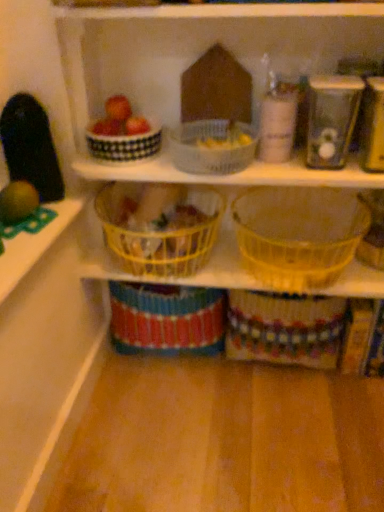
Describe the element at coordinates (125, 145) in the screenshot. I see `white checkered basket at upper center, the 4th basket when ordered from right to left` at that location.

Identify the location of translucent plastic basket at center, placed as the third basket when sorted from left to right. This screenshot has height=512, width=384. (213, 147).

What is the approximate width of matte red apple at upper left?

2.27 inches.

This screenshot has width=384, height=512. What are the coordinates of `metallic silver toaster at upper right, which ranks as the 2th appliance in left-to-right order` in the screenshot? It's located at (373, 126).

Image resolution: width=384 pixels, height=512 pixels. In order to click on metallic silver canister at upper right, which is counted as the 2th appliance, starting from the right in this screenshot , I will do `click(331, 119)`.

Locate an element on the screen. Image resolution: width=384 pixels, height=512 pixels. yellow plastic basket at center, the third basket viewed from the right is located at coordinates (160, 231).

Is metallic silver canister at upper right, which is counted as the 2th appliance, starting from the right, oriented towards translucent plastic basket at center, which is the second basket from right to left?

No, metallic silver canister at upper right, which is counted as the 2th appliance, starting from the right, is not turned towards translucent plastic basket at center, which is the second basket from right to left.

In the scene shown: In terms of height, does metallic silver canister at upper right, which is the first appliance in left-to-right order, look taller or shorter compared to translucent plastic basket at center, which is the second basket from right to left?

Considering their sizes, metallic silver canister at upper right, which is the first appliance in left-to-right order, has more height than translucent plastic basket at center, which is the second basket from right to left.

Based on the photo, in terms of width, does metallic silver canister at upper right, which is counted as the 2th appliance, starting from the right, look wider or thinner when compared to translucent plastic basket at center, placed as the third basket when sorted from left to right?

Clearly, metallic silver canister at upper right, which is counted as the 2th appliance, starting from the right, has less width compared to translucent plastic basket at center, placed as the third basket when sorted from left to right.

In the scene shown: Between matte red apple at upper left and metallic silver canister at upper right, which is the first appliance in left-to-right order, which one has larger width?

With larger width is metallic silver canister at upper right, which is the first appliance in left-to-right order.

Is metallic silver canister at upper right, which is the first appliance in left-to-right order, completely or partially inside matte red apple at upper left?

Definitely not — metallic silver canister at upper right, which is the first appliance in left-to-right order, is not inside matte red apple at upper left.

Does matte red apple at upper left have a smaller size compared to metallic silver canister at upper right, which is the first appliance in left-to-right order?

Yes, matte red apple at upper left is smaller than metallic silver canister at upper right, which is the first appliance in left-to-right order.

Based on the photo, does matte red apple at upper left turn towards metallic silver canister at upper right, which is the first appliance in left-to-right order?

No.

How many degrees apart are the facing directions of white checkered basket at upper center, which ranks as the first basket in left-to-right order, and translucent plastic basket at center, positioned as the fourth basket in left-to-right order?

There is a 0.00244-degree angle between the facing directions of white checkered basket at upper center, which ranks as the first basket in left-to-right order, and translucent plastic basket at center, positioned as the fourth basket in left-to-right order.

Could you tell me if white checkered basket at upper center, which ranks as the first basket in left-to-right order, is facing translucent plastic basket at center, positioned as the fourth basket in left-to-right order?

No.

Based on the photo, is white checkered basket at upper center, the 4th basket when ordered from right to left, positioned beyond the bounds of translucent plastic basket at center, acting as the first basket starting from the right?

Indeed, white checkered basket at upper center, the 4th basket when ordered from right to left, is completely outside translucent plastic basket at center, acting as the first basket starting from the right.

Does white checkered basket at upper center, which ranks as the first basket in left-to-right order, appear on the left side of translucent plastic basket at center, positioned as the fourth basket in left-to-right order?

Correct, you'll find white checkered basket at upper center, which ranks as the first basket in left-to-right order, to the left of translucent plastic basket at center, positioned as the fourth basket in left-to-right order.

Based on the photo, from the image's perspective, relative to matte red apple at upper left, is white checkered basket at upper center, the 4th basket when ordered from right to left, above or below?

From the image's perspective, white checkered basket at upper center, the 4th basket when ordered from right to left, appears below matte red apple at upper left.

Considering the positions of objects white checkered basket at upper center, the 4th basket when ordered from right to left, and matte red apple at upper left in the image provided, who is more to the left, white checkered basket at upper center, the 4th basket when ordered from right to left, or matte red apple at upper left?

From the viewer's perspective, matte red apple at upper left appears more on the left side.

From a real-world perspective, is white checkered basket at upper center, which ranks as the first basket in left-to-right order, on top of matte red apple at upper left?

No, from a real-world perspective, white checkered basket at upper center, which ranks as the first basket in left-to-right order, is not on top of matte red apple at upper left.

Do you think metallic silver toaster at upper right, marked as the first appliance in a right-to-left arrangement, is within matte red apple at upper left, or outside of it?

metallic silver toaster at upper right, marked as the first appliance in a right-to-left arrangement, is located beyond the bounds of matte red apple at upper left.

Starting from the matte red apple at upper left, which appliance is the 2nd one in front? Please provide its 2D coordinates.

[(373, 126)]

From a real-world perspective, is metallic silver toaster at upper right, marked as the first appliance in a right-to-left arrangement, over matte red apple at upper left?

Incorrect, from a real-world perspective, metallic silver toaster at upper right, marked as the first appliance in a right-to-left arrangement, is lower than matte red apple at upper left.

Between metallic silver toaster at upper right, marked as the first appliance in a right-to-left arrangement, and matte red apple at upper left, which one appears on the right side from the viewer's perspective?

metallic silver toaster at upper right, marked as the first appliance in a right-to-left arrangement, is more to the right.

Is point (130, 112) less distant than point (380, 169)?

That is False.

Is matte red apple at upper left facing towards metallic silver toaster at upper right, marked as the first appliance in a right-to-left arrangement?

No, matte red apple at upper left is not oriented towards metallic silver toaster at upper right, marked as the first appliance in a right-to-left arrangement.

Considering their positions, is matte red apple at upper left located in front of or behind metallic silver toaster at upper right, which ranks as the 2th appliance in left-to-right order?

In the image, matte red apple at upper left appears behind metallic silver toaster at upper right, which ranks as the 2th appliance in left-to-right order.

Which object is closer to the camera, translucent plastic basket at center, placed as the third basket when sorted from left to right, or white checkered basket at upper center, which ranks as the first basket in left-to-right order?

translucent plastic basket at center, placed as the third basket when sorted from left to right, is closer to the camera.

From a real-world perspective, is translucent plastic basket at center, which is the second basket from right to left, positioned above or below white checkered basket at upper center, which ranks as the first basket in left-to-right order?

translucent plastic basket at center, which is the second basket from right to left, is below white checkered basket at upper center, which ranks as the first basket in left-to-right order.

Is translucent plastic basket at center, placed as the third basket when sorted from left to right, bigger than white checkered basket at upper center, the 4th basket when ordered from right to left?

Yes.

Which appliance is the 1st one when counting from the right side of the translucent plastic basket at center, placed as the third basket when sorted from left to right? Please provide its 2D coordinates.

[(331, 119)]

The height and width of the screenshot is (512, 384). I want to click on apple on the left of metallic silver canister at upper right, which is the first appliance in left-to-right order, so click(118, 108).

Which object lies further to the anchor point white checkered basket at upper center, which ranks as the first basket in left-to-right order, metallic silver canister at upper right, which is the first appliance in left-to-right order, or translucent plastic basket at center, acting as the first basket starting from the right?

translucent plastic basket at center, acting as the first basket starting from the right, is positioned further to the anchor white checkered basket at upper center, which ranks as the first basket in left-to-right order.

Based on their spatial positions, is yellow plastic basket at center, placed as the second basket when sorted from left to right, or metallic silver toaster at upper right, marked as the first appliance in a right-to-left arrangement, further from metallic silver canister at upper right, which is the first appliance in left-to-right order?

Based on the image, yellow plastic basket at center, placed as the second basket when sorted from left to right, appears to be further to metallic silver canister at upper right, which is the first appliance in left-to-right order.

When comparing their distances from yellow plastic basket at center, the third basket viewed from the right, does metallic silver canister at upper right, which is the first appliance in left-to-right order, or white checkered basket at upper center, the 4th basket when ordered from right to left, seem further?

Among the two, metallic silver canister at upper right, which is the first appliance in left-to-right order, is located further to yellow plastic basket at center, the third basket viewed from the right.

When comparing their distances from white checkered basket at upper center, which ranks as the first basket in left-to-right order, does yellow plastic basket at center, the third basket viewed from the right, or translucent plastic basket at center, acting as the first basket starting from the right, seem closer?

Based on the image, yellow plastic basket at center, the third basket viewed from the right, appears to be nearer to white checkered basket at upper center, which ranks as the first basket in left-to-right order.

Which object lies further to the anchor point matte red apple at upper left, translucent plastic basket at center, acting as the first basket starting from the right, or white checkered basket at upper center, the 4th basket when ordered from right to left?

translucent plastic basket at center, acting as the first basket starting from the right, is positioned further to the anchor matte red apple at upper left.

Estimate the real-world distances between objects in this image. Which object is further from translucent plastic basket at center, positioned as the fourth basket in left-to-right order, translucent plastic basket at center, placed as the third basket when sorted from left to right, or metallic silver canister at upper right, which is counted as the 2th appliance, starting from the right?

translucent plastic basket at center, placed as the third basket when sorted from left to right, lies further to translucent plastic basket at center, positioned as the fourth basket in left-to-right order, than the other object.

Considering their positions, is yellow plastic basket at center, placed as the second basket when sorted from left to right, positioned further to white checkered basket at upper center, which ranks as the first basket in left-to-right order, than metallic silver canister at upper right, which is the first appliance in left-to-right order?

Based on the image, metallic silver canister at upper right, which is the first appliance in left-to-right order, appears to be further to white checkered basket at upper center, which ranks as the first basket in left-to-right order.

Looking at the image, which one is located further to translucent plastic basket at center, placed as the third basket when sorted from left to right, metallic silver canister at upper right, which is the first appliance in left-to-right order, or translucent plastic basket at center, acting as the first basket starting from the right?

translucent plastic basket at center, acting as the first basket starting from the right, lies further to translucent plastic basket at center, placed as the third basket when sorted from left to right, than the other object.

This screenshot has height=512, width=384. In order to click on appliance between translucent plastic basket at center, which is the second basket from right to left, and metallic silver toaster at upper right, which ranks as the 2th appliance in left-to-right order, in the horizontal direction in this screenshot , I will do coord(331,119).

In order to click on basket between translucent plastic basket at center, which is the second basket from right to left, and metallic silver canister at upper right, which is the first appliance in left-to-right order, from left to right in this screenshot , I will do click(298, 234).

Locate an element on the screen. appliance situated between white checkered basket at upper center, the 4th basket when ordered from right to left, and metallic silver toaster at upper right, marked as the first appliance in a right-to-left arrangement, from left to right is located at coordinates (331, 119).

This screenshot has width=384, height=512. Find the location of `appliance between metallic silver canister at upper right, which is counted as the 2th appliance, starting from the right, and translucent plastic basket at center, positioned as the fourth basket in left-to-right order, in the up-down direction`. appliance between metallic silver canister at upper right, which is counted as the 2th appliance, starting from the right, and translucent plastic basket at center, positioned as the fourth basket in left-to-right order, in the up-down direction is located at coordinates (373, 126).